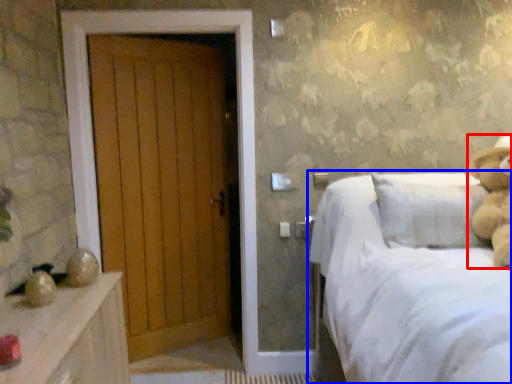
Question: Which object is further to the camera taking this photo, teddy bear (highlighted by a red box) or bed (highlighted by a blue box)?

Choices:
 (A) teddy bear
 (B) bed

Answer: (A)